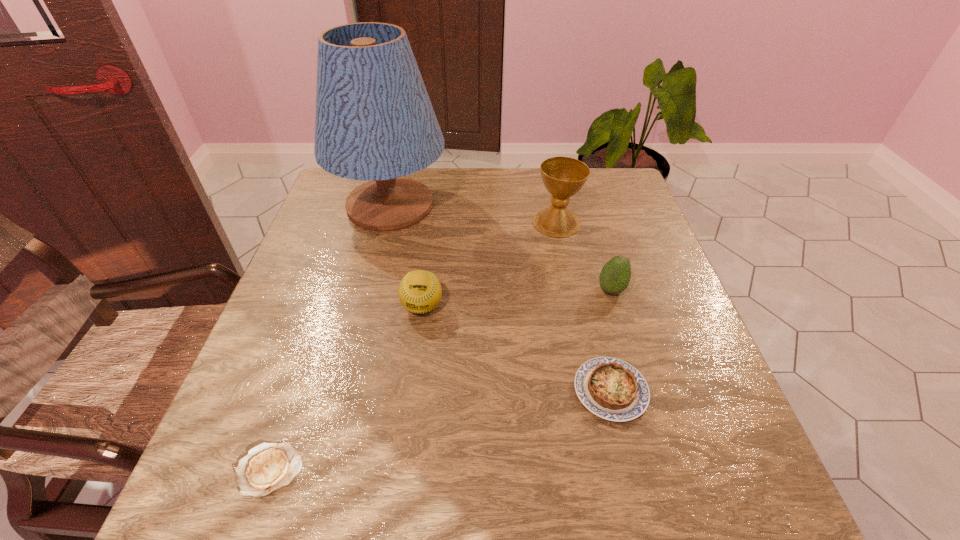
Image resolution: width=960 pixels, height=540 pixels. I want to click on lampshade, so click(x=374, y=121).

Locate an element on the screen. The width and height of the screenshot is (960, 540). the fifth shortest object is located at coordinates (563, 177).

Find the location of a particular element. avocado is located at coordinates (615, 275).

You are a GUI agent. You are given a task and a screenshot of the screen. Output one action in this format:
    pyautogui.click(x=<x>, y=<y>)
    Task: Click on the softball
    The height and width of the screenshot is (540, 960).
    Given the screenshot: What is the action you would take?
    pyautogui.click(x=419, y=291)

The image size is (960, 540). In order to click on the right quiche in this screenshot , I will do `click(610, 388)`.

You are a GUI agent. You are given a task and a screenshot of the screen. Output one action in this format:
    pyautogui.click(x=<x>, y=<y>)
    Task: Click on the taller quiche
    This screenshot has height=540, width=960.
    Given the screenshot: What is the action you would take?
    pyautogui.click(x=610, y=388)

Identify the location of the shortest object. This screenshot has height=540, width=960. (267, 467).

Locate an element on the screen. the shorter quiche is located at coordinates (267, 467).

Where is `vacant space located on the front of the lampshade`? vacant space located on the front of the lampshade is located at coordinates (352, 355).

In order to click on vacant space located 0.330m on the left of the fifth shortest object in this screenshot , I will do `click(413, 222)`.